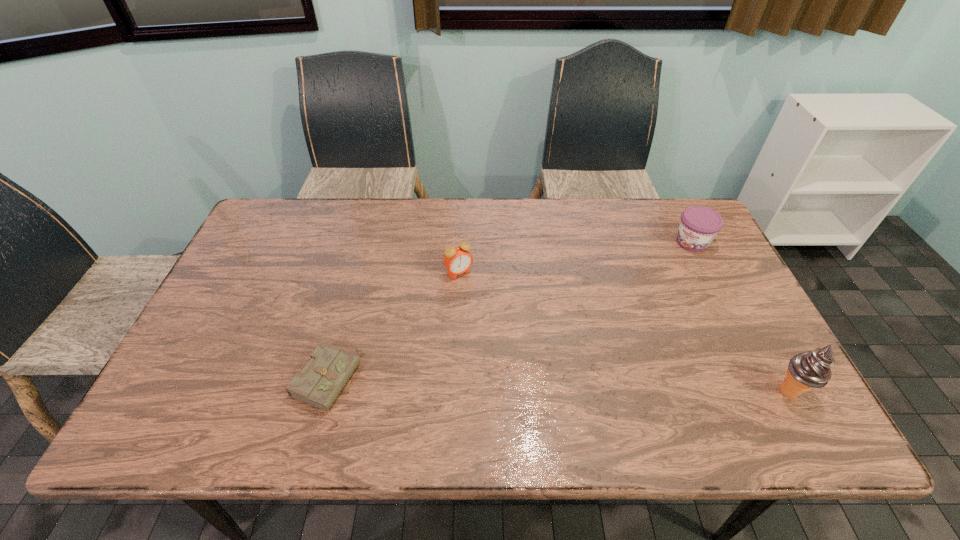
Locate an element on the screen. This screenshot has width=960, height=540. blank space located on the face of the third object from right to left is located at coordinates (527, 363).

This screenshot has height=540, width=960. I want to click on vacant area situated on the face of the third object from right to left, so click(477, 296).

Identify the location of vacant space located 0.360m on the front label of the third tallest object. Image resolution: width=960 pixels, height=540 pixels. (623, 319).

The height and width of the screenshot is (540, 960). I want to click on free space located 0.050m on the front label of the third tallest object, so click(677, 259).

Identify the location of blank space located on the front label of the third tallest object. (623, 319).

Locate an element on the screen. object that is at the far edge is located at coordinates (699, 225).

I want to click on diary that is at the near edge, so pyautogui.click(x=321, y=381).

The image size is (960, 540). I want to click on icecream located in the near edge section of the desktop, so click(x=807, y=370).

Identify the location of icecream that is positioned at the right edge. click(807, 370).

You are a GUI agent. You are given a task and a screenshot of the screen. Output one action in this format:
    pyautogui.click(x=<x>, y=<y>)
    Task: Click on the jam that is at the right edge
    
    Given the screenshot: What is the action you would take?
    pyautogui.click(x=699, y=225)